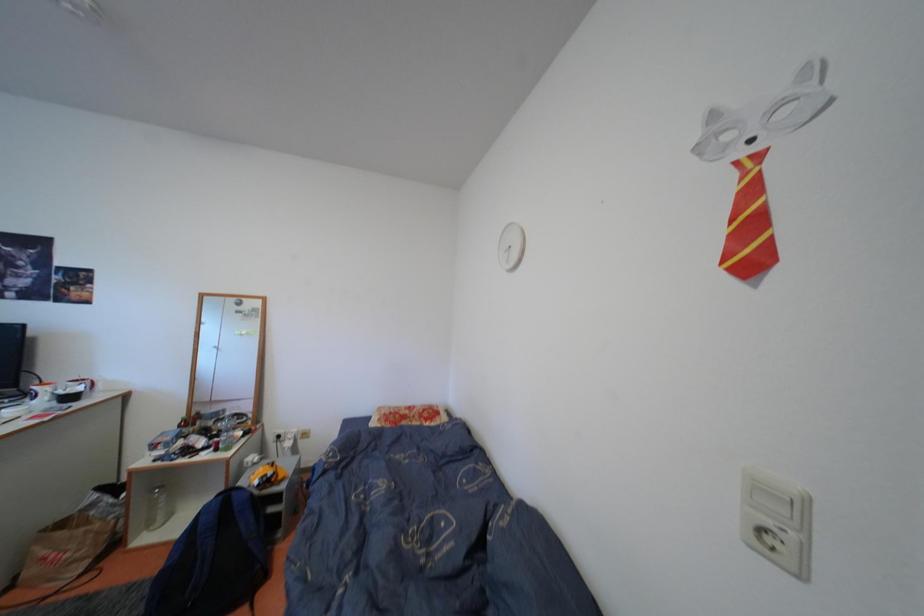
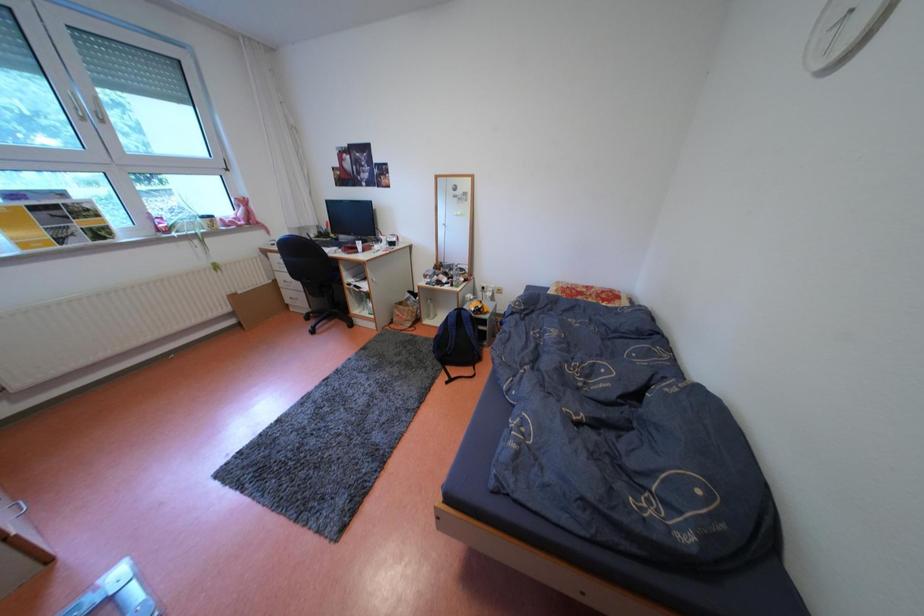
How did the camera likely rotate?

The rotation direction of the camera is left-down.